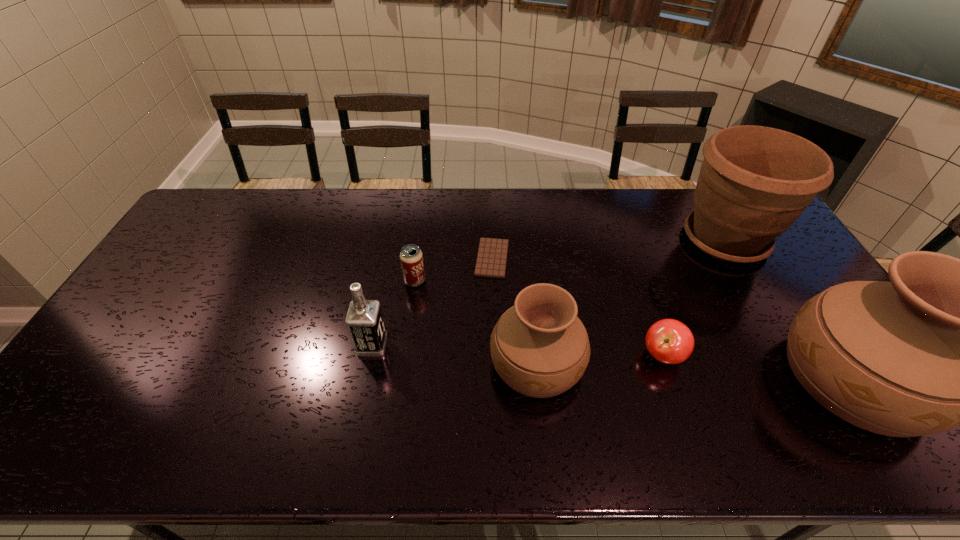
Please point out where to position a new urn on the left to maintain spacing. Please provide its 2D coordinates. Your answer should be formatted as a tuple, i.e. [(x, y)], where the tuple contains the x and y coordinates of a point satisfying the conditions above.

[(237, 348)]